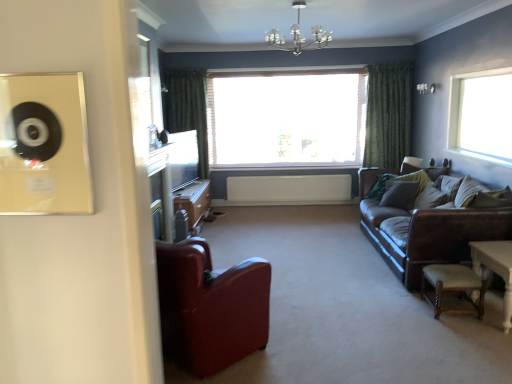
Question: Is brown leather couch at right aimed at white wooden table at lower right?

Choices:
 (A) no
 (B) yes

Answer: (A)

Question: Does brown leather couch at right lie behind white wooden table at lower right?

Choices:
 (A) no
 (B) yes

Answer: (B)

Question: From the image's perspective, does brown leather couch at right appear higher than white wooden table at lower right?

Choices:
 (A) yes
 (B) no

Answer: (A)

Question: Is brown leather couch at right closer to the viewer compared to white wooden table at lower right?

Choices:
 (A) no
 (B) yes

Answer: (A)

Question: Does brown leather couch at right appear on the left side of white wooden table at lower right?

Choices:
 (A) no
 (B) yes

Answer: (B)

Question: In terms of height, does green fabric pillow at center, the 2th pillow in the right-to-left sequence, look taller or shorter compared to white wooden table at lower right?

Choices:
 (A) tall
 (B) short

Answer: (B)

Question: Based on their sizes in the image, would you say green fabric pillow at center, the 1th pillow when ordered from back to front, is bigger or smaller than white wooden table at lower right?

Choices:
 (A) small
 (B) big

Answer: (A)

Question: In the image, is green fabric pillow at center, which ranks as the second pillow in front-to-back order, positioned in front of or behind white wooden table at lower right?

Choices:
 (A) behind
 (B) front

Answer: (A)

Question: Which is correct: green fabric pillow at center, which is counted as the first pillow, starting from the left, is inside white wooden table at lower right, or outside of it?

Choices:
 (A) inside
 (B) outside

Answer: (B)

Question: Is brown leather couch at right taller or shorter than white wooden window at center, which appears as the 2th window when viewed from the right?

Choices:
 (A) tall
 (B) short

Answer: (B)

Question: From the image's perspective, relative to white wooden window at center, marked as the 2th window in a front-to-back arrangement, is brown leather couch at right above or below?

Choices:
 (A) above
 (B) below

Answer: (B)

Question: Is brown leather couch at right bigger or smaller than white wooden window at center, marked as the 2th window in a front-to-back arrangement?

Choices:
 (A) big
 (B) small

Answer: (A)

Question: From a real-world perspective, is brown leather couch at right physically located above or below white wooden window at center, marked as the 1th window in a back-to-front arrangement?

Choices:
 (A) above
 (B) below

Answer: (B)

Question: Considering the positions of wooden cabinet at center and white wooden window at center, which appears as the 2th window when viewed from the right, in the image, is wooden cabinet at center taller or shorter than white wooden window at center, which appears as the 2th window when viewed from the right,?

Choices:
 (A) short
 (B) tall

Answer: (A)

Question: From a real-world perspective, is wooden cabinet at center above or below white wooden window at center, acting as the first window starting from the left?

Choices:
 (A) above
 (B) below

Answer: (B)